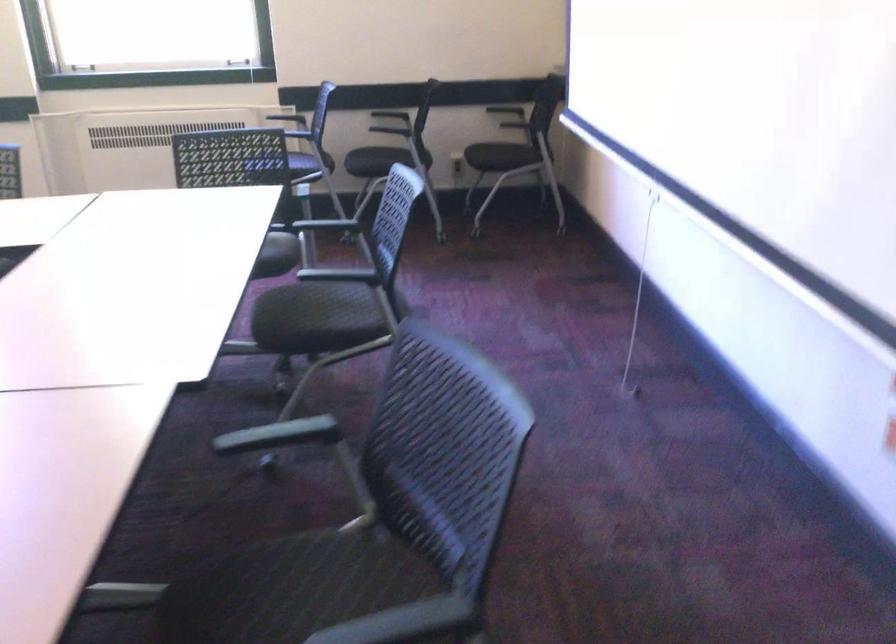
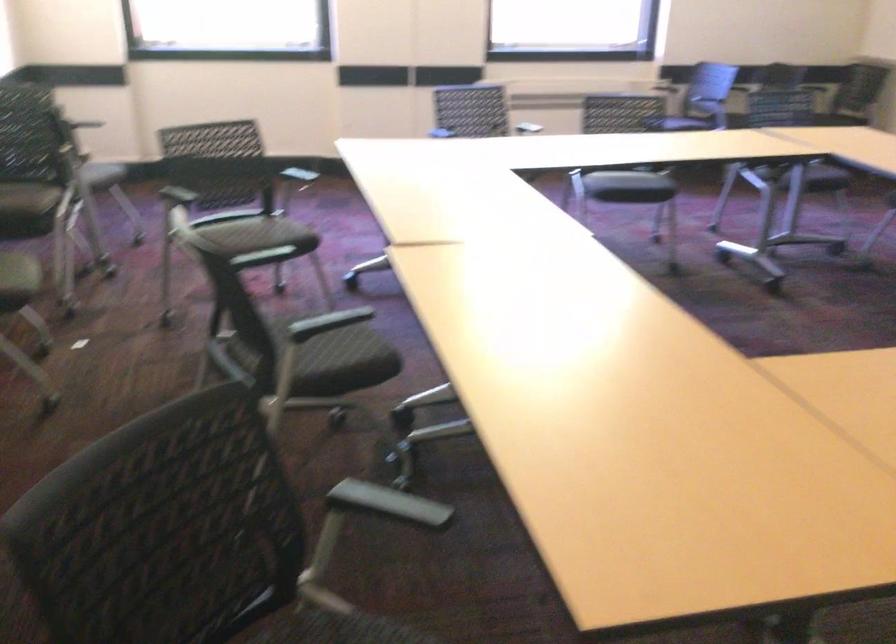
In a continuous first-person perspective shot, in which direction is the camera moving?

The movement direction of the cameraman is left, backward.